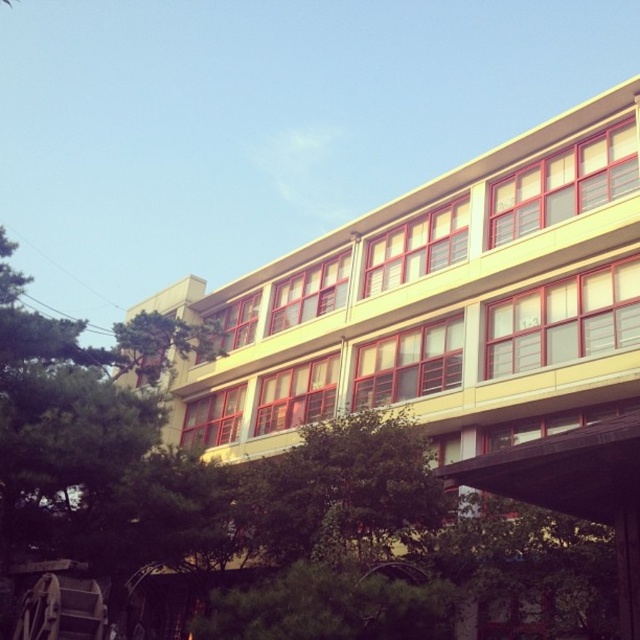
Question: Can you confirm if yellow matte building at center is thinner than green leafy tree at center?

Choices:
 (A) yes
 (B) no

Answer: (B)

Question: Which point is farther to the camera?

Choices:
 (A) (540, 412)
 (B) (291, 493)

Answer: (A)

Question: Which of the following is the farthest from the observer?

Choices:
 (A) green leafy tree at center
 (B) yellow matte building at center

Answer: (A)

Question: Is yellow matte building at center to the right of green leafy tree at center from the viewer's perspective?

Choices:
 (A) no
 (B) yes

Answer: (A)

Question: Is the position of yellow matte building at center less distant than that of green leafy tree at center?

Choices:
 (A) no
 (B) yes

Answer: (B)